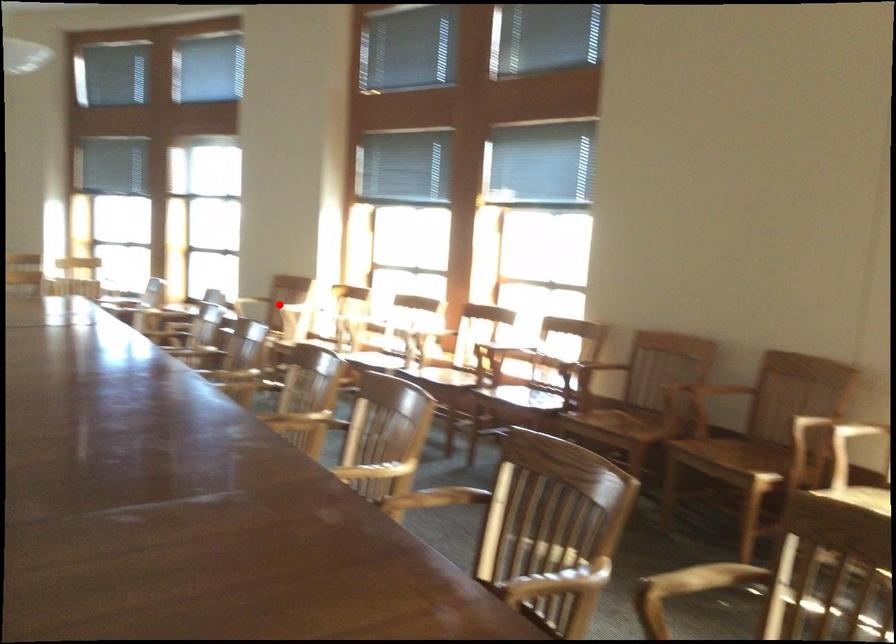
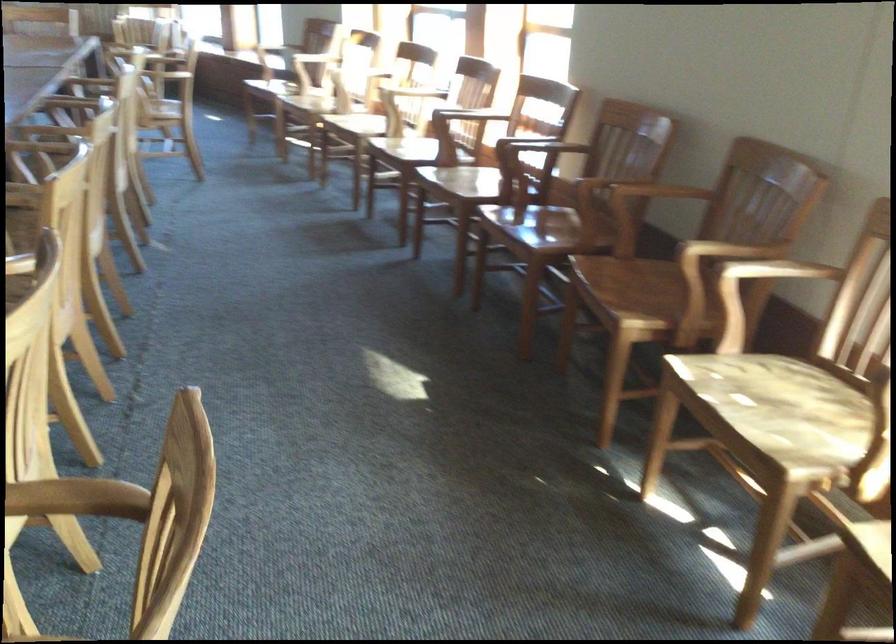
Question: I am providing you with two images of the same scene from different viewpoints. A red point is marked on the first image. At the location where the point appears in image 1, is it still visible in image 2?

Choices:
 (A) Yes
 (B) No

Answer: (A)